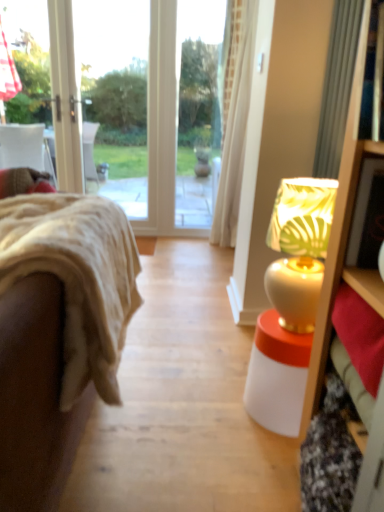
Question: From the image's perspective, is white glossy table lamp at right positioned above or below velvet beige couch at left?

Choices:
 (A) below
 (B) above

Answer: (B)

Question: From a real-world perspective, is white glossy table lamp at right physically located above or below velvet beige couch at left?

Choices:
 (A) below
 (B) above

Answer: (B)

Question: Considering the positions of white glossy table lamp at right and velvet beige couch at left in the image, is white glossy table lamp at right taller or shorter than velvet beige couch at left?

Choices:
 (A) short
 (B) tall

Answer: (B)

Question: Is velvet beige couch at left wider or thinner than white glossy table lamp at right?

Choices:
 (A) thin
 (B) wide

Answer: (B)

Question: Does point (18, 246) appear closer or farther from the camera than point (302, 238)?

Choices:
 (A) closer
 (B) farther

Answer: (A)

Question: From the image's perspective, is velvet beige couch at left above or below white glossy table lamp at right?

Choices:
 (A) below
 (B) above

Answer: (A)

Question: From their relative heights in the image, would you say velvet beige couch at left is taller or shorter than white glossy table lamp at right?

Choices:
 (A) tall
 (B) short

Answer: (B)